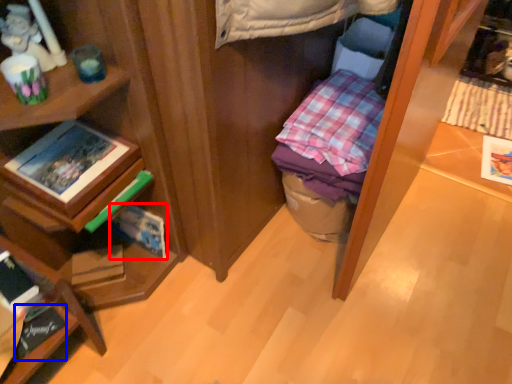
Question: Which object appears closest to the camera in this image, paperback book (highlighted by a red box) or book (highlighted by a blue box)?

Choices:
 (A) paperback book
 (B) book

Answer: (B)